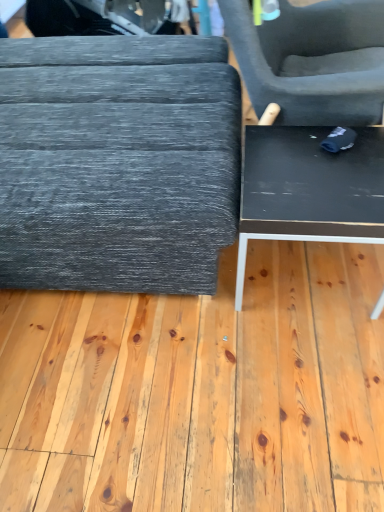
Locate an element on the screen. Image resolution: width=384 pixels, height=512 pixels. blank space situated above black glossy table at lower right, the 2th table positioned from the left (from a real-world perspective) is located at coordinates (322, 170).